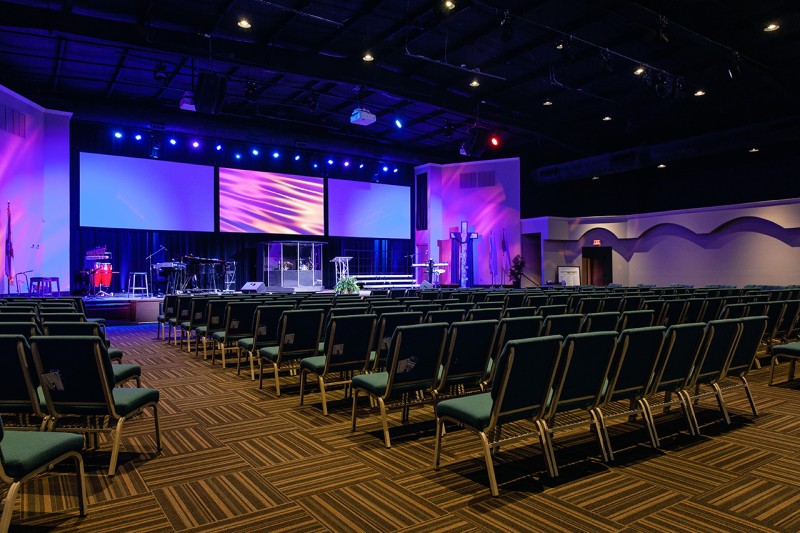
Locate an element on the screen. led is located at coordinates (382, 201).